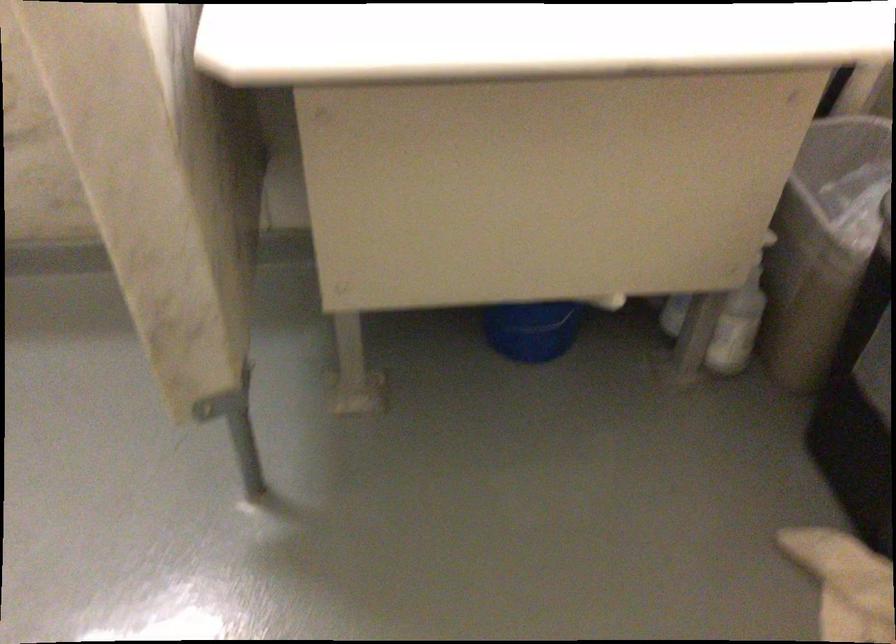
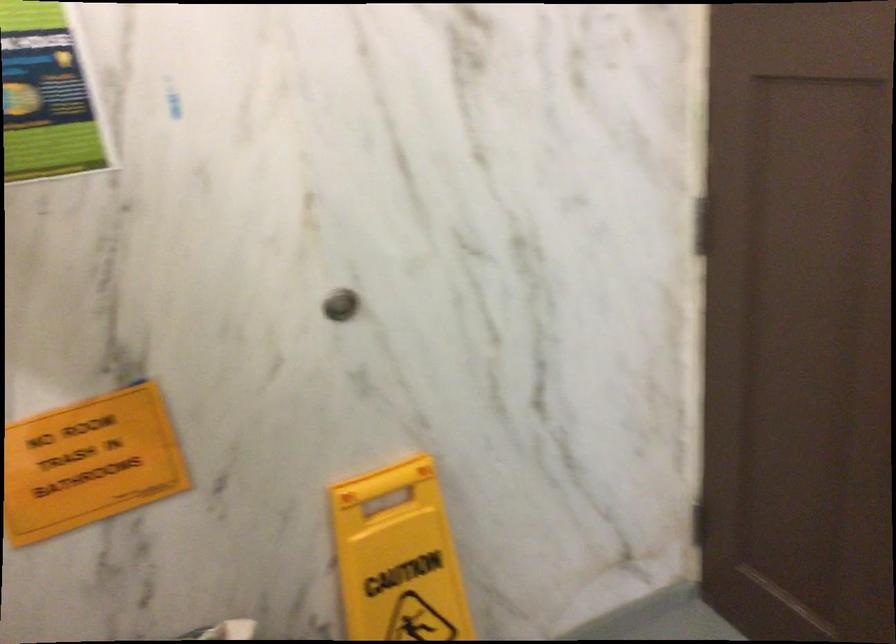
The images are taken continuously from a first-person perspective. In which direction is your viewpoint rotating?

The camera's rotation is toward right-down.